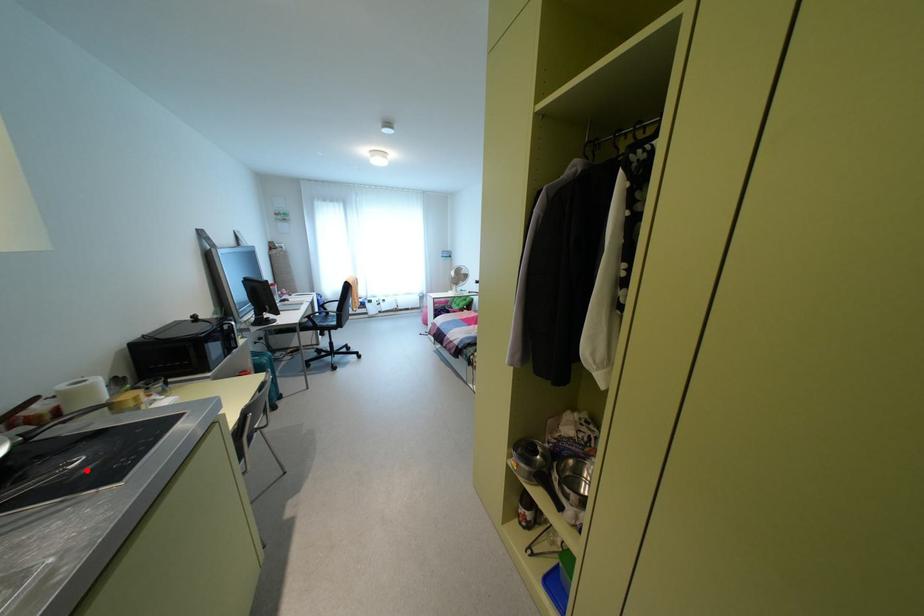
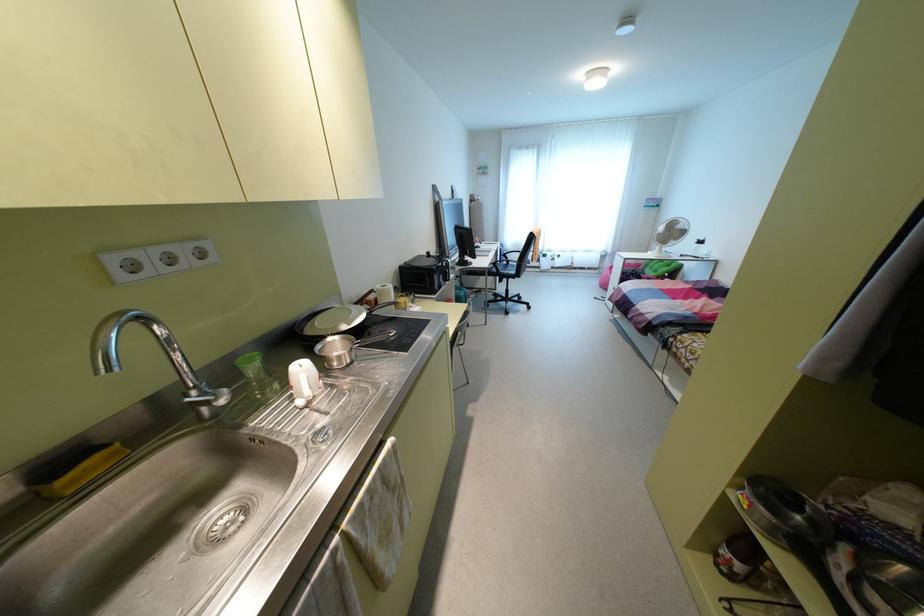
Find the pixel in the second image that matches the highlighted location in the first image.

(392, 339)